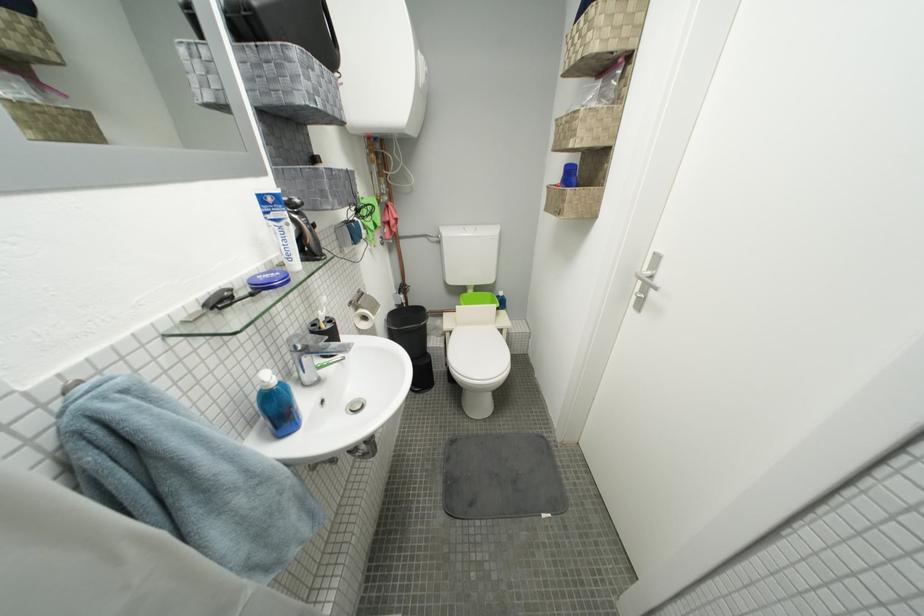
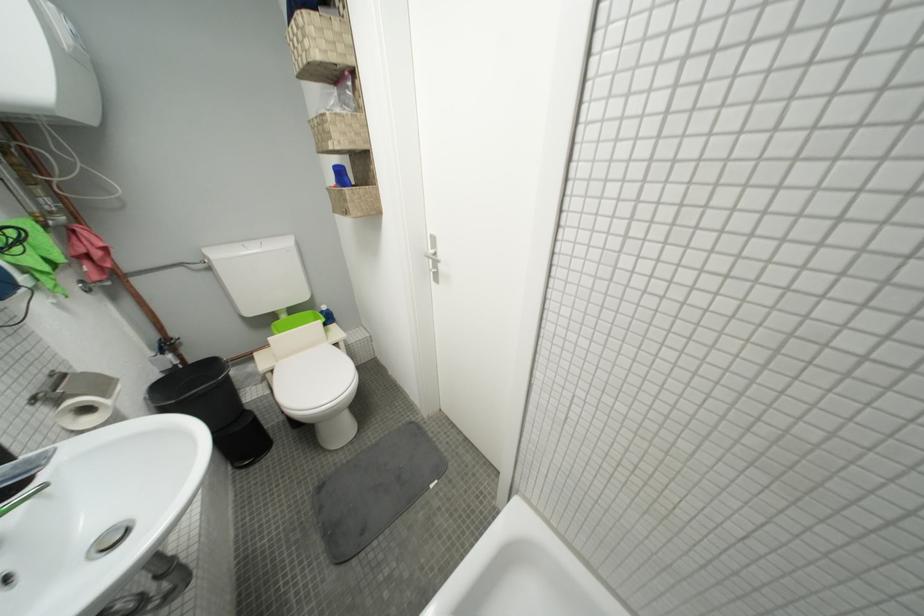
The point at (568,216) is marked in the first image. Where is the corresponding point in the second image?

(354, 216)